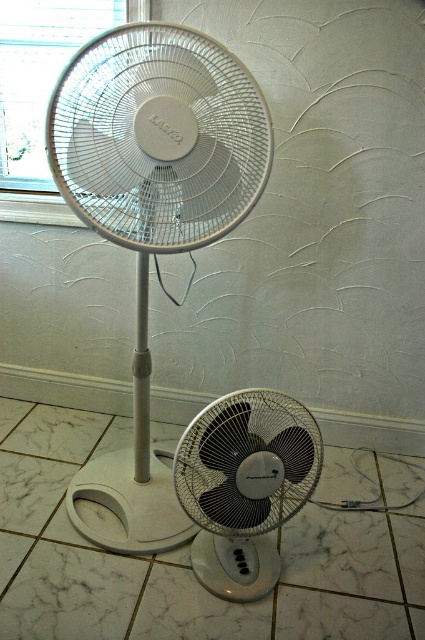
In the scene shown: Does white plastic mechanical fan at upper center lie in front of black plastic fan at lower center?

That is True.

Who is positioned more to the left, white plastic mechanical fan at upper center or black plastic fan at lower center?

Positioned to the left is white plastic mechanical fan at upper center.

At what (x,y) coordinates should I click in order to perform the action: click on white plastic mechanical fan at upper center. Please return your answer as a coordinate pair (x, y). Looking at the image, I should click on (153, 209).

Locate an element on the screen. The width and height of the screenshot is (425, 640). white plastic mechanical fan at upper center is located at coordinates (153, 209).